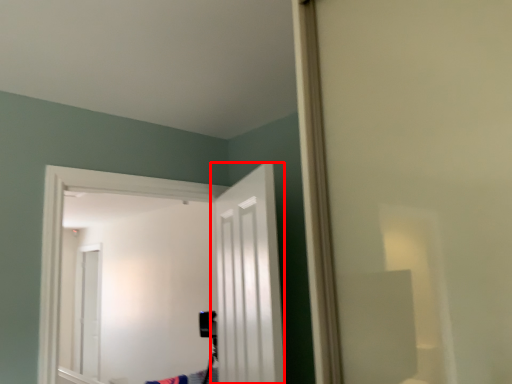
Question: Observing the image, what is the correct spatial positioning of door (annotated by the red box) in reference to door?

Choices:
 (A) left
 (B) right

Answer: (B)